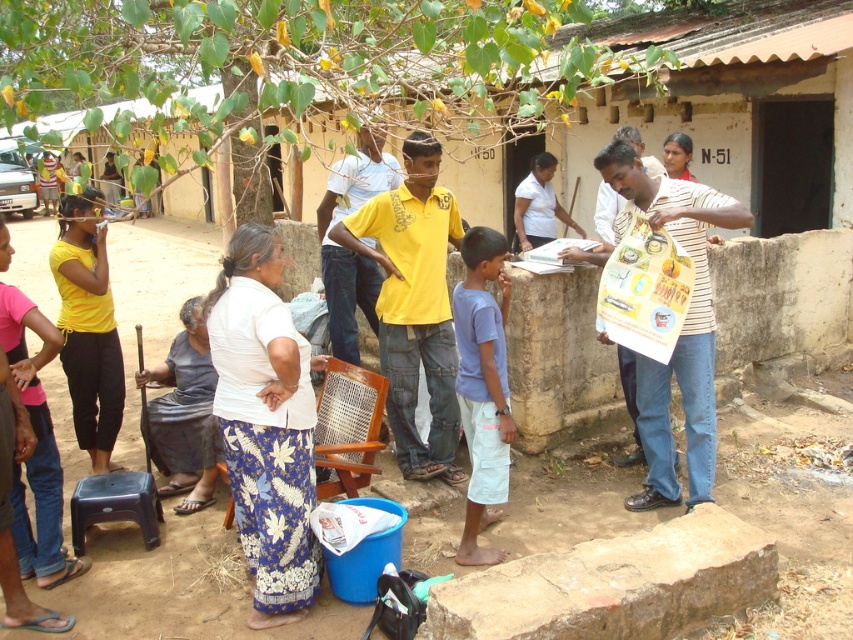
Question: Which point is farther to the camera?

Choices:
 (A) (93, 189)
 (B) (148, 492)

Answer: (A)

Question: Is matte yellow shirt at left below matte plastic stool at lower left?

Choices:
 (A) yes
 (B) no

Answer: (B)

Question: Is matte yellow shirt at left to the right of matte plastic stool at lower left from the viewer's perspective?

Choices:
 (A) no
 (B) yes

Answer: (A)

Question: Estimate the real-world distances between objects in this image. Which object is closer to the matte plastic stool at lower left?

Choices:
 (A) matte yellow shirt at left
 (B) white woven fabric at center

Answer: (A)

Question: Can you confirm if matte yellow shirt at left is positioned above matte plastic stool at lower left?

Choices:
 (A) no
 (B) yes

Answer: (B)

Question: Which object appears farthest from the camera in this image?

Choices:
 (A) white woven fabric at center
 (B) matte plastic stool at lower left

Answer: (B)